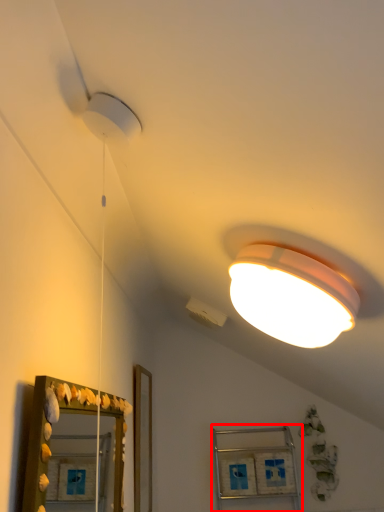
Question: Considering the relative positions of cabinet (annotated by the red box) and mirror in the image provided, where is cabinet (annotated by the red box) located with respect to the staircase?

Choices:
 (A) left
 (B) right

Answer: (B)